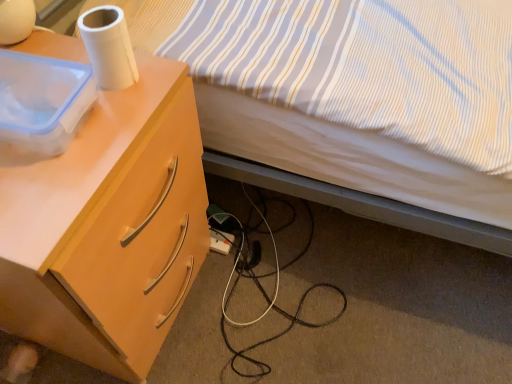
Question: From a real-world perspective, is white plastic power outlet at lower center physically located above or below white matte paper towel at upper left?

Choices:
 (A) above
 (B) below

Answer: (B)

Question: Considering the positions of point (224, 238) and point (130, 51), is point (224, 238) closer or farther from the camera than point (130, 51)?

Choices:
 (A) farther
 (B) closer

Answer: (A)

Question: Estimate the real-world distances between objects in this image. Which object is farther from the white plastic power outlet at lower center?

Choices:
 (A) transparent plastic container at upper left
 (B) white matte paper towel at upper left
 (C) light wood/finish desk at left
 (D) striped fabric bed at upper right

Answer: (A)

Question: Which object is the closest to the striped fabric bed at upper right?

Choices:
 (A) light wood/finish desk at left
 (B) transparent plastic container at upper left
 (C) white plastic power outlet at lower center
 (D) white matte paper towel at upper left

Answer: (A)